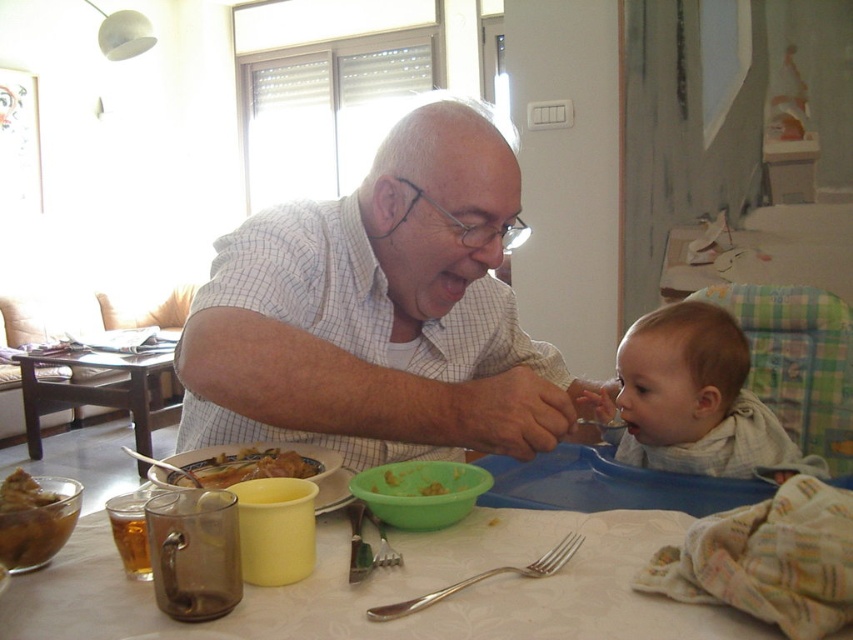
You are standing at the dining table and see two points marked on the tablecloth. Which point is closer to you, point (50, 496) or point (175, 481)?

Point (50, 496) is closer to the viewer than point (175, 481).

What are the coordinates of the white checkered shirt at center?

The white checkered shirt at center is located at coordinates point (379, 312).

You are a parent trying to place a small toy on the wooden table at center where the yellow rubbery food at center is located. Can you tell me if the toy will fit on the table without falling off the edge?

The wooden table at center is taller than yellow rubbery food at center, but the description does not provide information about the table edge or the toy size. Therefore, it is uncertain if the toy will fit without falling off the edge.